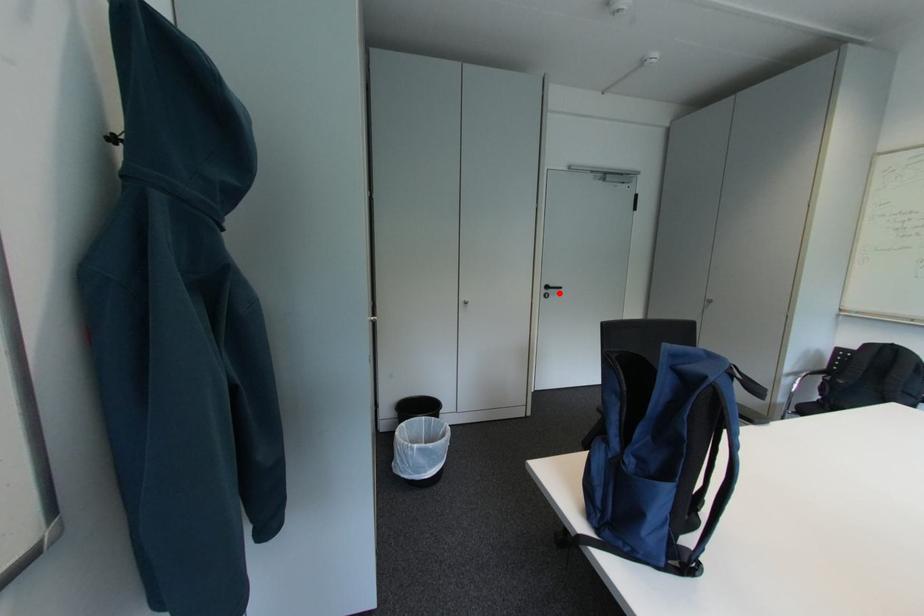
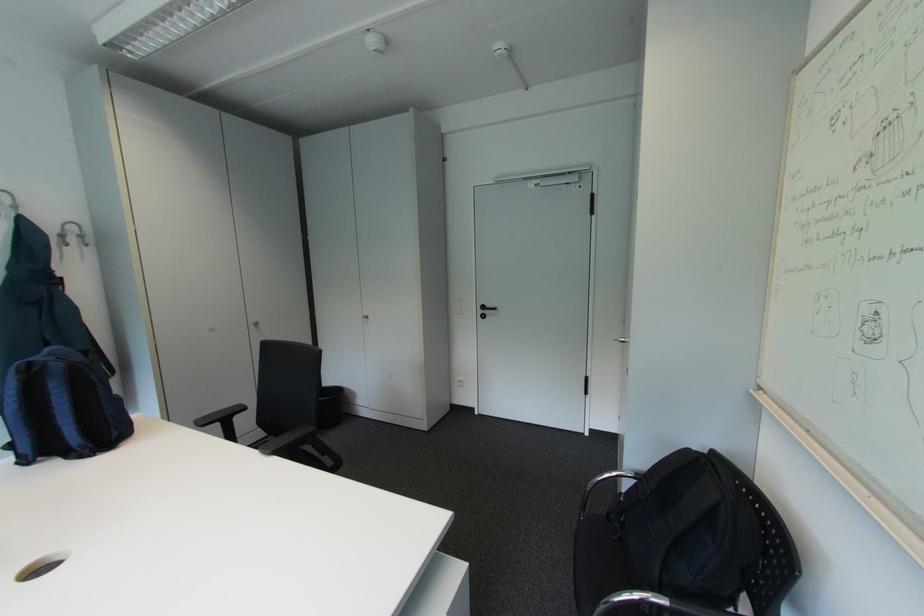
The point at the highlighted location is marked in the first image. Where is the corresponding point in the second image?

(495, 314)